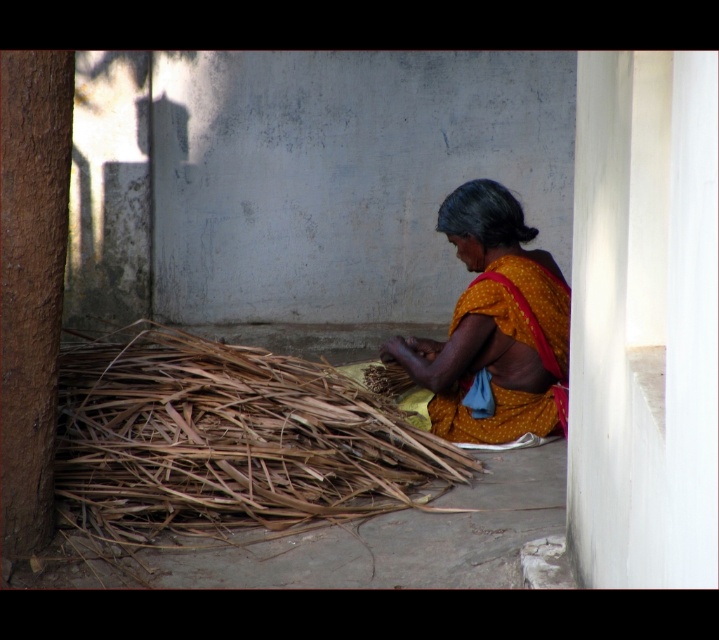
Is brown dry reed at lower left to the left of yellow dotted fabric at center from the viewer's perspective?

Correct, you'll find brown dry reed at lower left to the left of yellow dotted fabric at center.

Which is above, brown dry reed at lower left or yellow dotted fabric at center?

yellow dotted fabric at center

Which is behind, point (96, 518) or point (508, 205)?

Positioned behind is point (508, 205).

This screenshot has height=640, width=719. Identify the location of brown dry reed at lower left. (229, 442).